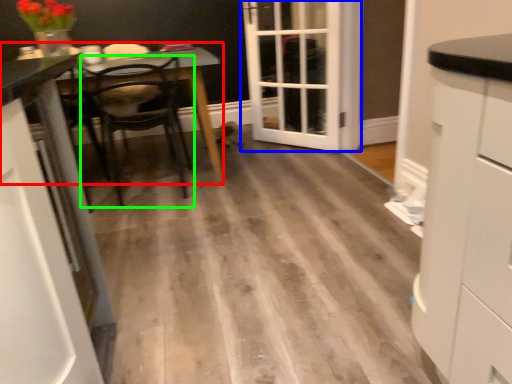
Question: Based on their relative distances, which object is farther from table (highlighted by a red box)? Choose from door (highlighted by a blue box) and chair (highlighted by a green box).

Choices:
 (A) door
 (B) chair

Answer: (A)